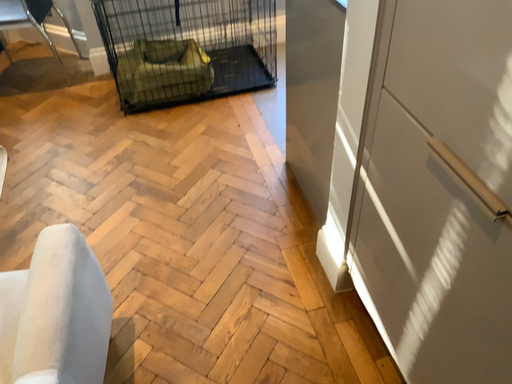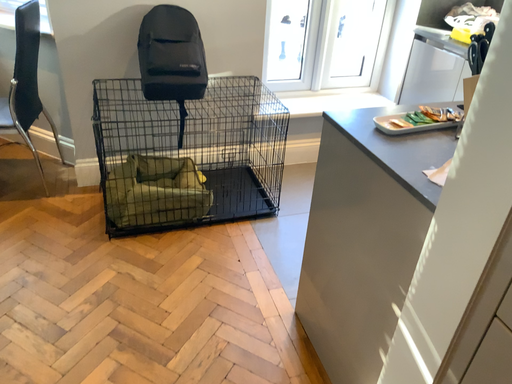
Question: Which way did the camera rotate in the video?

Choices:
 (A) rotated upward
 (B) rotated downward

Answer: (A)